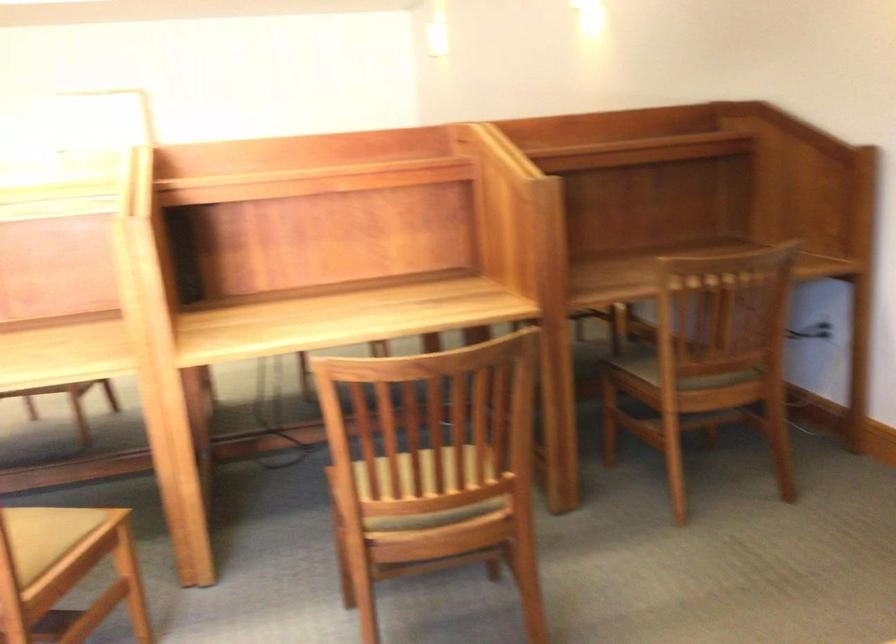
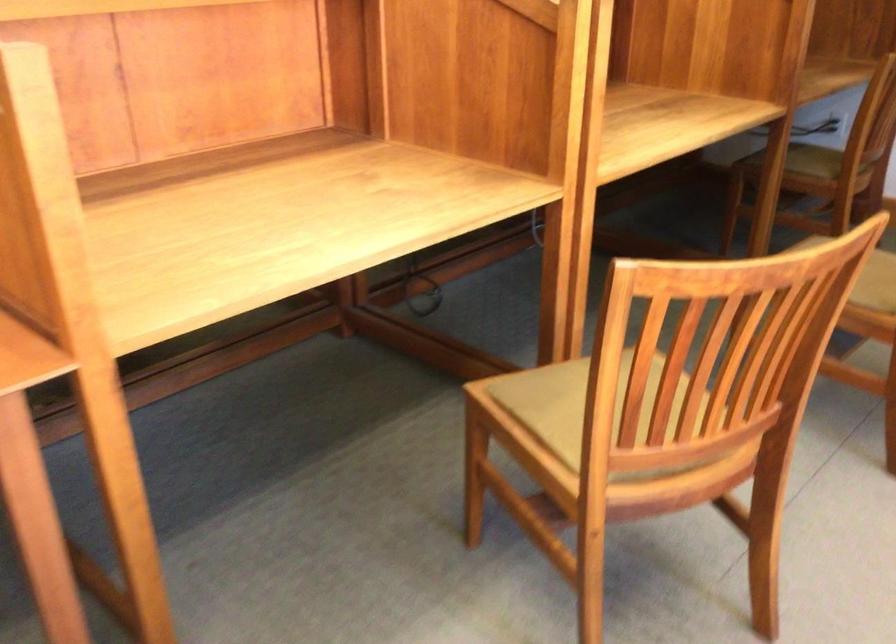
The point at (376, 497) is marked in the first image. Where is the corresponding point in the second image?

(869, 275)